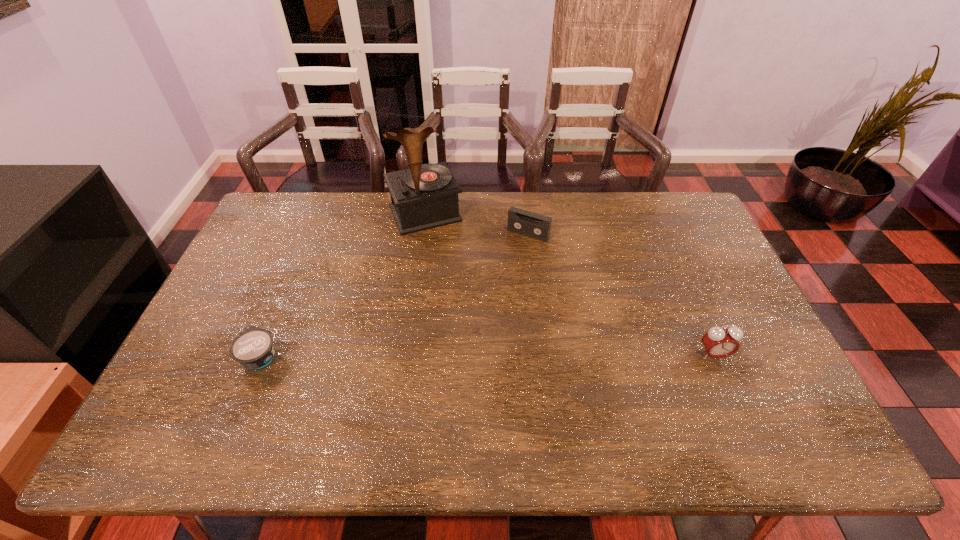
In the image, there is a desktop. Identify the location of free space at the far edge. (559, 204).

Image resolution: width=960 pixels, height=540 pixels. Identify the location of free space at the left edge of the desktop. (194, 362).

Find the location of a particular element. vacant space at the right edge of the desktop is located at coordinates (678, 242).

Identify the location of free space at the far left corner of the desktop. (274, 218).

This screenshot has height=540, width=960. I want to click on free space at the near left corner of the desktop, so pyautogui.click(x=180, y=384).

In order to click on vacant space at the far right corner of the desktop in this screenshot , I will do `click(676, 227)`.

The width and height of the screenshot is (960, 540). Find the location of `free space between the alarm clock and the second object from right to left`. free space between the alarm clock and the second object from right to left is located at coordinates (620, 294).

Find the location of a particular element. Image resolution: width=960 pixels, height=540 pixels. unoccupied area between the yogurt and the second object from right to left is located at coordinates (395, 295).

Image resolution: width=960 pixels, height=540 pixels. I want to click on vacant space that's between the tallest object and the leftmost object, so click(343, 285).

Locate an element on the screen. The image size is (960, 540). blank region between the second object from right to left and the yogurt is located at coordinates (395, 295).